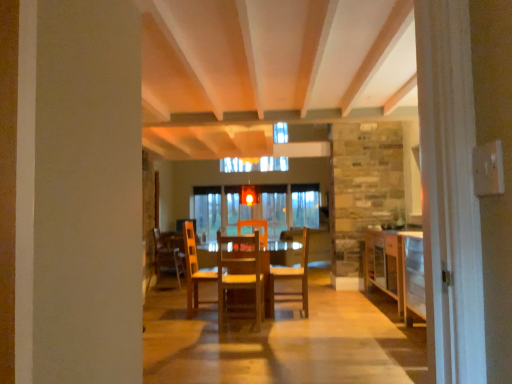
In order to click on vacant region in front of wooden chair at center, the second chair in the right-to-left sequence in this screenshot , I will do `click(251, 329)`.